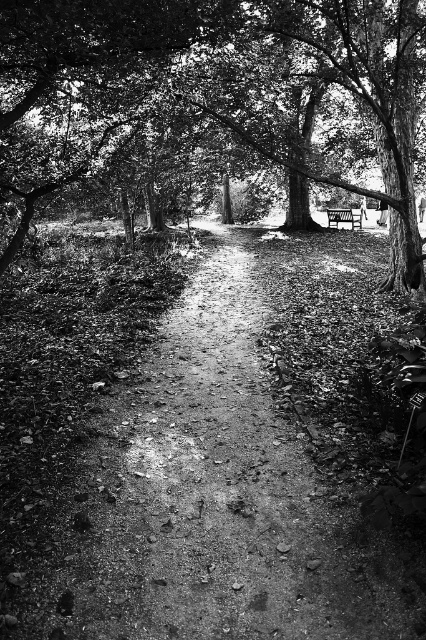
Question: Can you confirm if dirt path at center is positioned below smooth bark tree at center?

Choices:
 (A) yes
 (B) no

Answer: (A)

Question: Among these objects, which one is farthest from the camera?

Choices:
 (A) wooden bench at center
 (B) dirt path at center
 (C) smooth bark tree at center

Answer: (A)

Question: Which of the following is the farthest from the observer?

Choices:
 (A) (256, 8)
 (B) (345, 218)

Answer: (B)

Question: Can you confirm if smooth bark tree at center is positioned to the left of wooden bench at center?

Choices:
 (A) no
 (B) yes

Answer: (B)

Question: Which point appears farthest from the camera in this image?

Choices:
 (A) 267,44
 (B) 337,488

Answer: (A)

Question: Can you confirm if dirt path at center is wider than wooden bench at center?

Choices:
 (A) no
 (B) yes

Answer: (A)